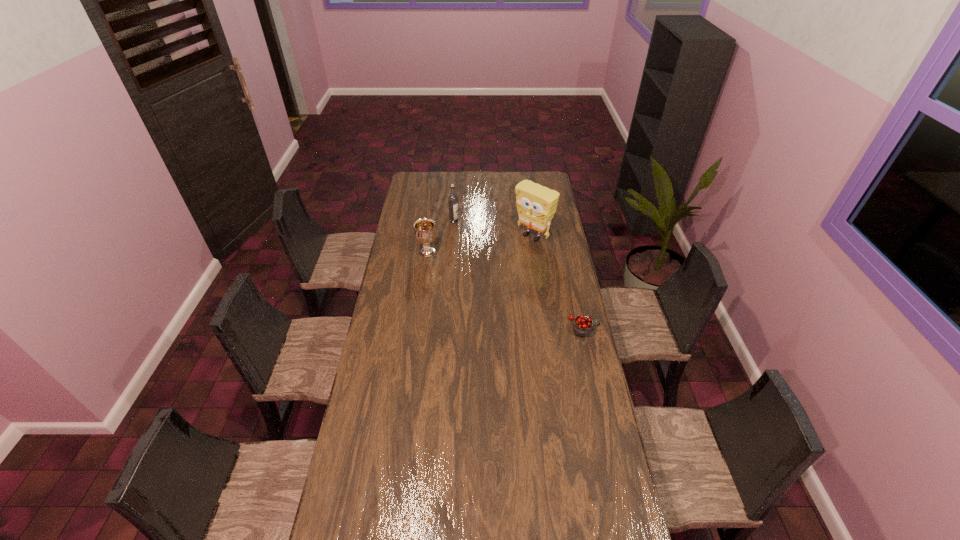
You are a GUI agent. You are given a task and a screenshot of the screen. Output one action in this format:
    pyautogui.click(x=<x>, y=<y>)
    Task: Click on the free space located 0.190m on the label of the second object from left to right
    Image resolution: width=960 pixels, height=540 pixels.
    Given the screenshot: What is the action you would take?
    pyautogui.click(x=467, y=244)

Image resolution: width=960 pixels, height=540 pixels. What are the coordinates of `vacant point located on the face of the tallest object` in the screenshot? It's located at (500, 262).

The height and width of the screenshot is (540, 960). What are the coordinates of `free space located on the face of the tallest object` in the screenshot? It's located at 493,268.

Identify the location of vacant space located 0.080m on the face of the tallest object. [512, 253].

Identify the location of object at the left edge. (425, 233).

The image size is (960, 540). I want to click on pot filled with cherries located at the right edge, so click(582, 326).

Locate an element on the screen. Image resolution: width=960 pixels, height=540 pixels. sponge that is positioned at the right edge is located at coordinates (536, 204).

This screenshot has width=960, height=540. In order to click on free space at the far edge of the desktop in this screenshot , I will do `click(516, 172)`.

This screenshot has height=540, width=960. In the image, there is a desktop. Identify the location of vacant space at the left edge. pos(397,310).

Locate an element on the screen. The image size is (960, 540). vacant space at the right edge is located at coordinates (567, 433).